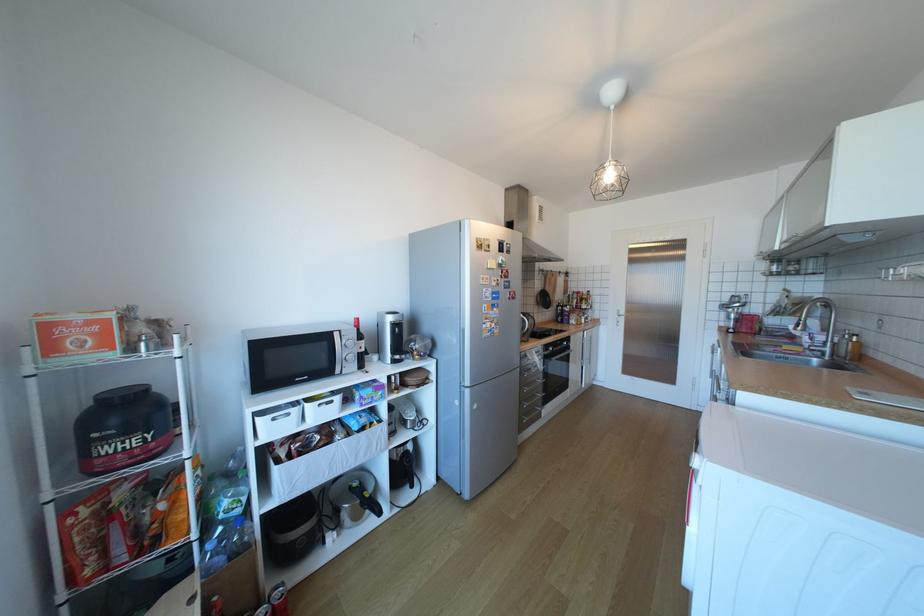
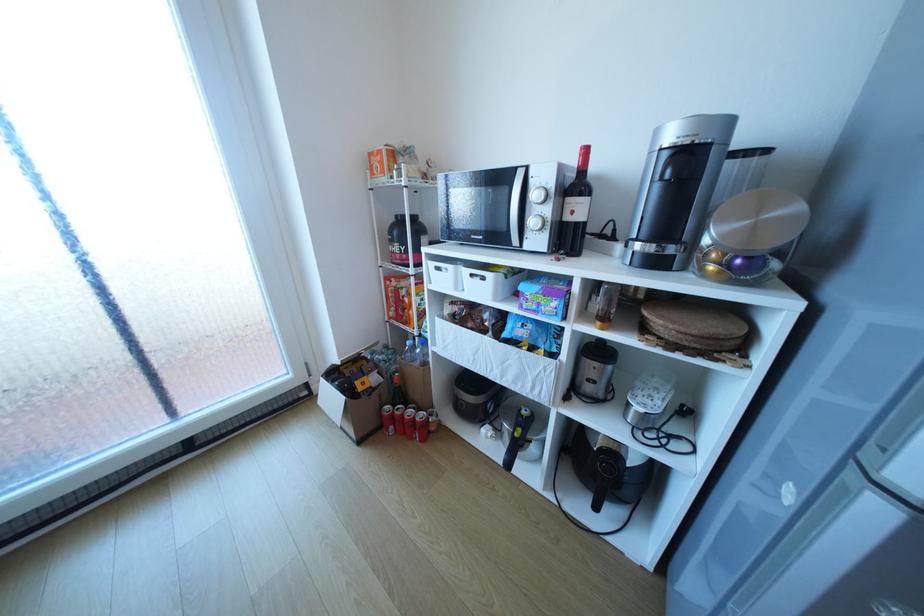
Where in the second image is the point corresponding to point 329,405 from the first image?

(481, 275)